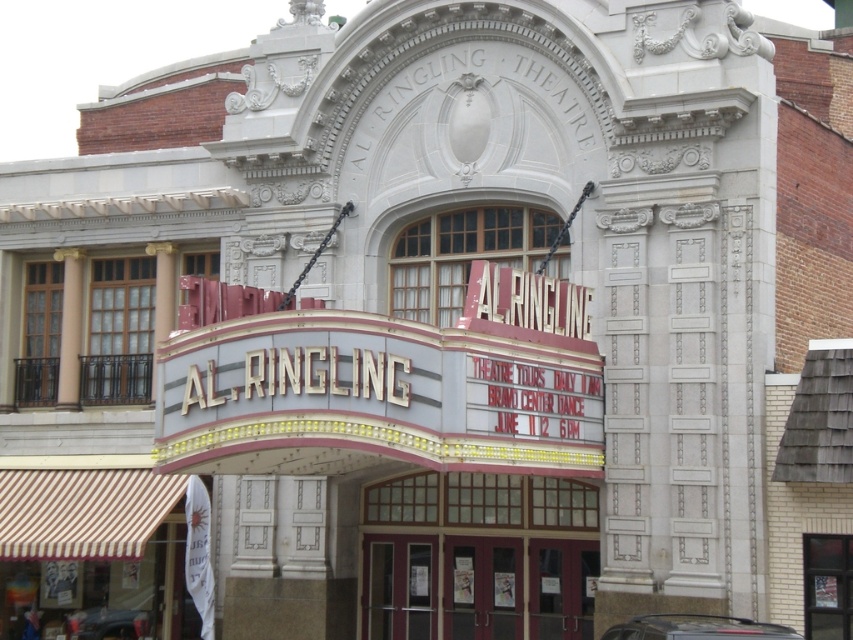
You are a tour guide leading a group to the Al Ringling Theatre. You notice two shiny black cars parked near the entrance. The group is curious about parking distance requirements. Can you determine if the distance between the shiny black car at lower center and the shiny black car at lower left meets the minimum 30 meters apart rule?

The shiny black car at lower center is 30.64 meters from the shiny black car at lower left, which exceeds the minimum 30 meters requirement. Therefore, the distance between them meets the parking rule.

Based on the photo, you are a visitor approaching the Al Ringling Theatre and see the glass door at center and the shiny black car at lower center. Which object is closer to you as you approach the entrance?

The shiny black car at lower center is closer to you because the glass door at center is positioned over it, indicating it is further away.

You are standing in front of the Al Ringling Theatre and want to locate two specific points marked on the facade. The first point is at coordinate point [810,554] and the second is at point [730,636]. Which of these points is closer to you?

Point [810,554] is closer to you because it is further to the viewer than point [730,636].